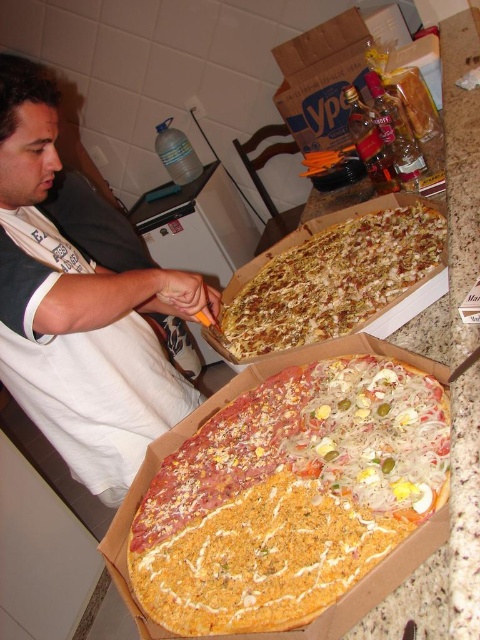
Question: Which point is closer to the camera?

Choices:
 (A) cheesy crust pizza at center
 (B) crusty golden-brown pizza at center

Answer: (A)

Question: Which object is positioned farthest from the white cotton shirt at left?

Choices:
 (A) cheesy crust pizza at center
 (B) crusty golden-brown pizza at center

Answer: (A)

Question: Which object appears farthest from the camera in this image?

Choices:
 (A) crusty golden-brown pizza at center
 (B) white cotton shirt at left

Answer: (A)

Question: Does cheesy crust pizza at center appear on the right side of crusty golden-brown pizza at center?

Choices:
 (A) no
 (B) yes

Answer: (A)

Question: Where is white cotton shirt at left located in relation to crusty golden-brown pizza at center in the image?

Choices:
 (A) right
 (B) left

Answer: (B)

Question: Can you confirm if white cotton shirt at left is thinner than crusty golden-brown pizza at center?

Choices:
 (A) yes
 (B) no

Answer: (A)